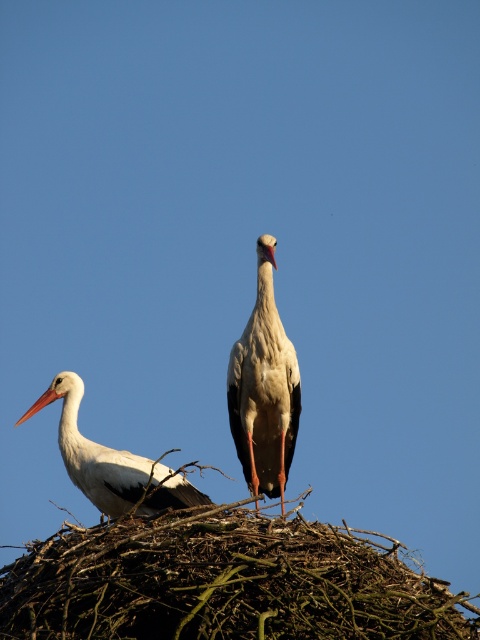
You are a birdwatcher observing the scene. You notice the brown twigs nest at center and the orange matte beak at upper left. Which object is positioned to the right of the other?

The brown twigs nest at center is to the right of the orange matte beak at upper left.

You are a birdwatcher observing the scene. You notice the white matte bird at left and the orange matte beak at upper left. Which object is positioned closer to you?

The white matte bird at left is closer to the viewer than the orange matte beak at upper left.